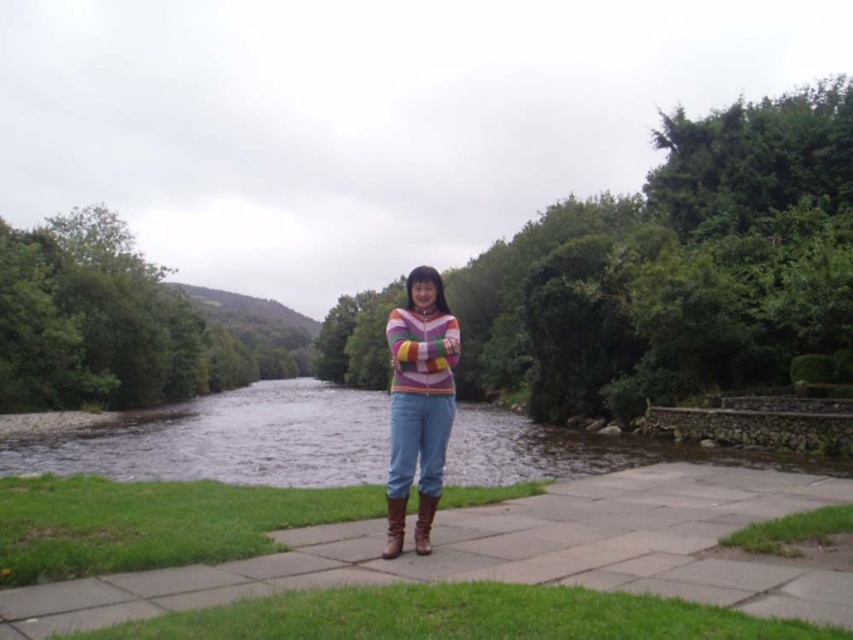
Question: Considering the real-world distances, which object is closest to the green soft grass at lower right?

Choices:
 (A) green grass at lower left
 (B) brown leather boot at center
 (C) striped sweater at center
 (D) green grass at lower center

Answer: (D)

Question: Which point is closer to the camera?

Choices:
 (A) striped sweater at center
 (B) green grass at lower center
 (C) brown leather boot at lower center

Answer: (B)

Question: Observing the image, what is the correct spatial positioning of brown leather pavement at center in reference to green grass at lower center?

Choices:
 (A) left
 (B) right

Answer: (B)

Question: Can you confirm if striped sweater at center is wider than green soft grass at lower right?

Choices:
 (A) yes
 (B) no

Answer: (B)

Question: Is green grass at lower left closer to camera compared to brown leather boot at lower center?

Choices:
 (A) no
 (B) yes

Answer: (A)

Question: Which point is farther from the camera taking this photo?

Choices:
 (A) (392, 557)
 (B) (57, 525)
 (C) (399, 493)
 (D) (782, 566)

Answer: (B)